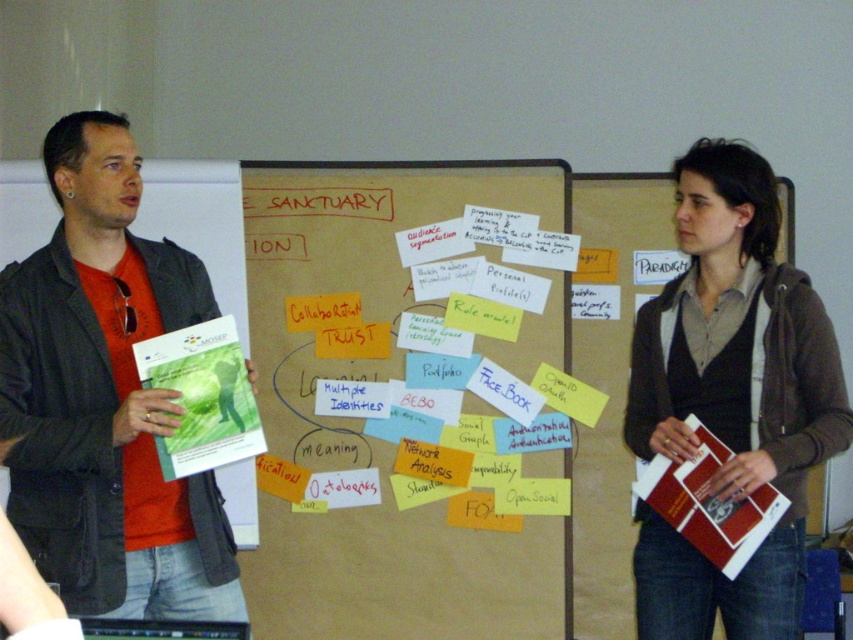
Which is behind, point (264, 275) or point (791, 348)?

The point (264, 275) is more distant.

Is brown paper bulletin board at center to the left of brown textured sweater at center from the viewer's perspective?

Indeed, brown paper bulletin board at center is positioned on the left side of brown textured sweater at center.

Between point (381, 221) and point (834, 340), which one is positioned behind?

The point (381, 221) is more distant.

Find the location of a particular element. This screenshot has width=853, height=640. brown paper bulletin board at center is located at coordinates (408, 397).

Is matte black jacket at left thinner than brown textured sweater at center?

In fact, matte black jacket at left might be wider than brown textured sweater at center.

Can you confirm if matte black jacket at left is bigger than brown textured sweater at center?

Actually, matte black jacket at left might be smaller than brown textured sweater at center.

Describe the element at coordinates (106, 397) in the screenshot. The width and height of the screenshot is (853, 640). I see `matte black jacket at left` at that location.

Where is `matte black jacket at left`? matte black jacket at left is located at coordinates (106, 397).

Can you confirm if brown paper bulletin board at center is shorter than matte black jacket at left?

No, brown paper bulletin board at center is not shorter than matte black jacket at left.

Is point (279, 244) positioned in front of point (102, 550)?

No, (279, 244) is further to viewer.

Which is behind, point (482, 516) or point (19, 282)?

Positioned behind is point (482, 516).

Where is `brown paper bulletin board at center`? brown paper bulletin board at center is located at coordinates (408, 397).